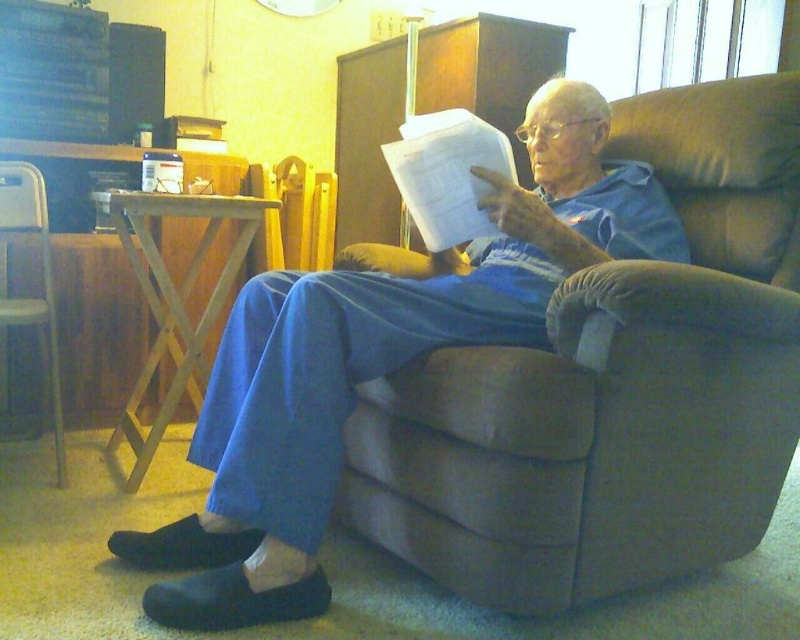
Based on the photo, which is more to the right, blue cotton pants at center or white paper at center?

white paper at center is more to the right.

Which is in front, point (300, 340) or point (436, 241)?

Point (300, 340)

Image resolution: width=800 pixels, height=640 pixels. Find the location of `blue cotton pants at center`. blue cotton pants at center is located at coordinates coord(376,364).

Which is above, white paper at center or metallic silver chair at left?

white paper at center

Locate an element on the screen. white paper at center is located at coordinates (448, 173).

Identify the location of white paper at center. (448, 173).

Is point (284, 609) positioned behind point (26, 163)?

No, (284, 609) is closer to viewer.

Is blue cotton pants at center below metallic silver chair at left?

Yes.

This screenshot has width=800, height=640. Find the location of `blue cotton pants at center`. blue cotton pants at center is located at coordinates (376, 364).